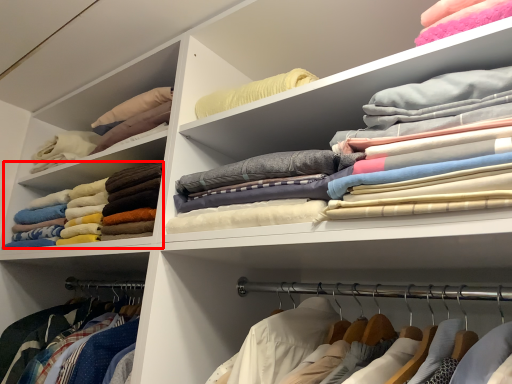
Question: From the image's perspective, considering the relative positions of clothing (annotated by the red box) and clothing in the image provided, where is clothing (annotated by the red box) located with respect to the staircase?

Choices:
 (A) below
 (B) above

Answer: (A)